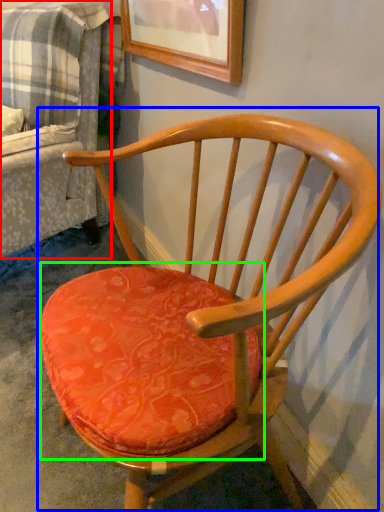
Question: Based on their relative distances, which object is farther from couch (highlighted by a red box)? Choose from chair (highlighted by a blue box) and table (highlighted by a green box).

Choices:
 (A) chair
 (B) table

Answer: (B)